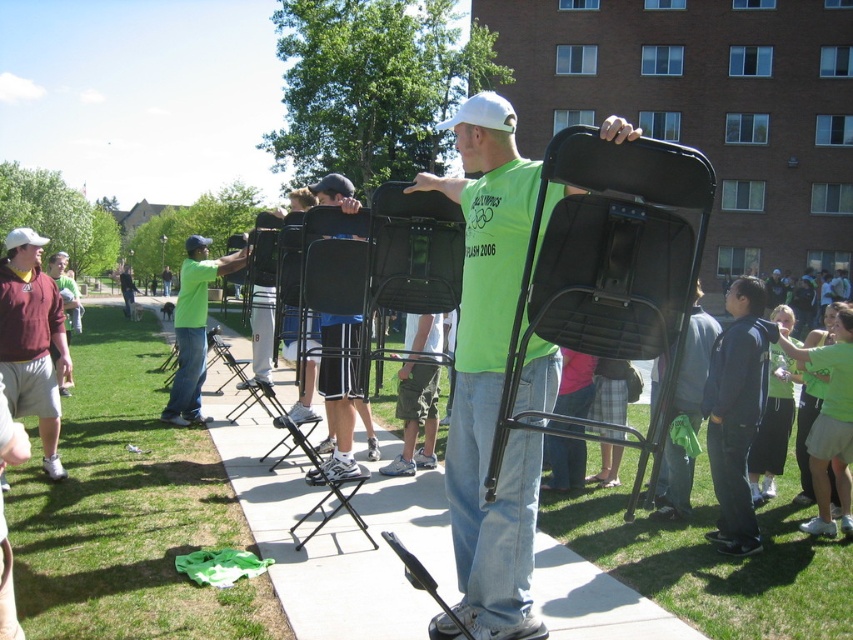
Is dark blue jacket at lower right positioned at the back of matte black shorts at center?

No, dark blue jacket at lower right is in front of matte black shorts at center.

Between dark blue jacket at lower right and matte black shorts at center, which one is positioned higher?

Positioned higher is matte black shorts at center.

This screenshot has height=640, width=853. Identify the location of dark blue jacket at lower right. (735, 412).

Is black plastic chair at center wider than maroon fabric shirt at left?

Yes, black plastic chair at center is wider than maroon fabric shirt at left.

Does point (537, 605) lie behind point (28, 346)?

No, it is not.

Locate an element on the screen. This screenshot has height=640, width=853. black plastic chair at center is located at coordinates (335, 536).

How far apart are black metal folding chair at center and neon green t-shirt at center?

The distance of black metal folding chair at center from neon green t-shirt at center is 19.50 feet.

Can you confirm if black metal folding chair at center is positioned above neon green t-shirt at center?

Answer: No, black metal folding chair at center is not above neon green t-shirt at center.

Who is more forward, [572,225] or [183,310]?

Positioned in front is point [572,225].

Find the location of a particular element. black metal folding chair at center is located at coordinates (607, 260).